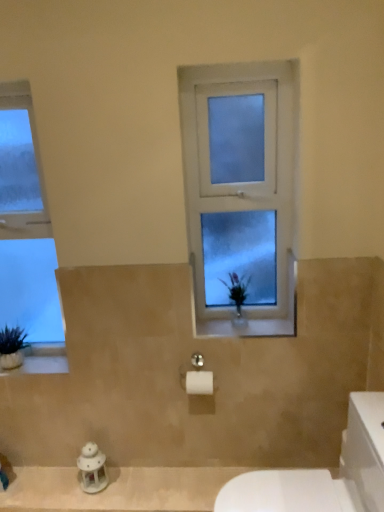
Where is `vacant space to the right of white porcelain lantern at lower left`? This screenshot has height=512, width=384. vacant space to the right of white porcelain lantern at lower left is located at coordinates (137, 482).